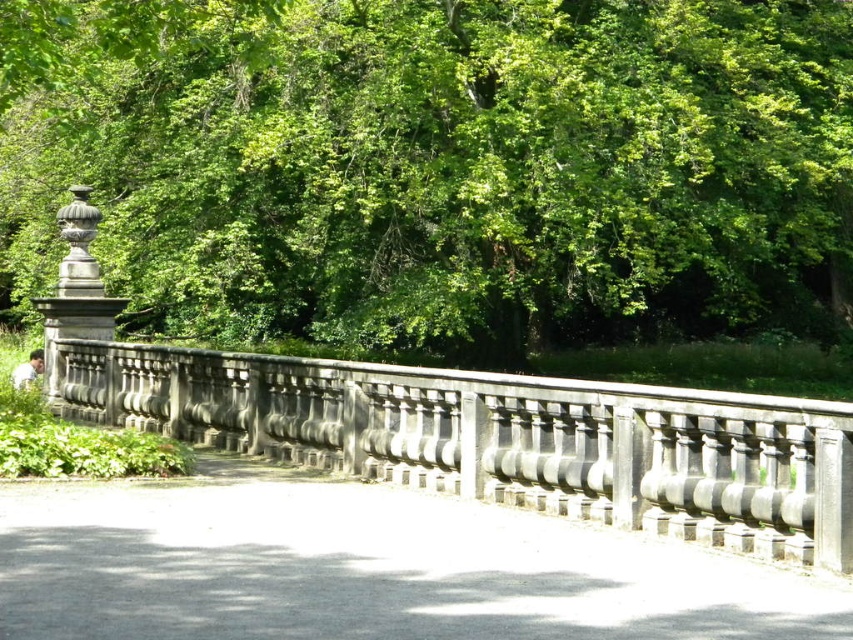
You are an artist sketching the scene and want to ensure the proportions are accurate. Which object should you draw wider between the green leafy tree at upper center and the gray stone fence at center?

The green leafy tree at upper center should be drawn wider because its width is larger than that of the gray stone fence at center.

You are a gardener who needs to place a 3 meter wide decorative stone slab on the gray concrete path at center or the gray stone fence at center. Based on their widths, which location can accommodate the slab?

The gray stone fence at center has a greater width than the gray concrete path at center. Therefore, the 3 meter wide decorative stone slab can be placed on the gray stone fence at center since it is wider.

Looking at the scene, which object has a greater width between the green leafy tree at upper center and the gray concrete path at center?

The green leafy tree at upper center has a greater width than the gray concrete path at center.